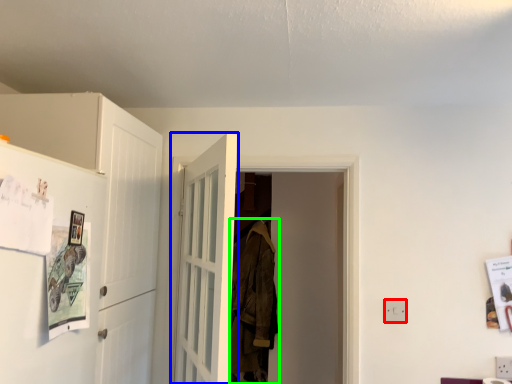
Question: Which object is positioned farthest from electric outlet (highlighted by a red box)? Select from door (highlighted by a blue box) and laundry (highlighted by a green box).

Choices:
 (A) door
 (B) laundry

Answer: (B)